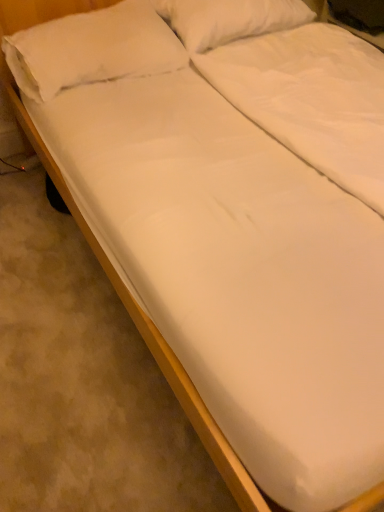
Question: Which direction should I rotate to look at white soft pillow at upper center, which ranks as the 2th pillow in left-to-right order?

Choices:
 (A) left
 (B) right

Answer: (B)

Question: Is white soft pillow at upper left, which is the second pillow from right to left, surrounding white soft pillow at upper center, which is the first pillow in right-to-left order?

Choices:
 (A) yes
 (B) no

Answer: (B)

Question: Is white soft pillow at upper left, which is the second pillow from right to left, wider than white soft pillow at upper center, which ranks as the 2th pillow in left-to-right order?

Choices:
 (A) yes
 (B) no

Answer: (A)

Question: From the image's perspective, would you say white soft pillow at upper left, arranged as the 1th pillow when viewed from the left, is shown under white soft pillow at upper center, which ranks as the 2th pillow in left-to-right order?

Choices:
 (A) no
 (B) yes

Answer: (B)

Question: From a real-world perspective, is white soft pillow at upper left, which is the second pillow from right to left, physically above white soft pillow at upper center, which is the first pillow in right-to-left order?

Choices:
 (A) no
 (B) yes

Answer: (A)

Question: Does white soft pillow at upper left, arranged as the 1th pillow when viewed from the left, have a lesser height compared to white soft pillow at upper center, which ranks as the 2th pillow in left-to-right order?

Choices:
 (A) yes
 (B) no

Answer: (A)

Question: Is white soft pillow at upper left, which is the second pillow from right to left, at the left side of white soft pillow at upper center, which is the first pillow in right-to-left order?

Choices:
 (A) no
 (B) yes

Answer: (B)

Question: Is white soft pillow at upper center, which ranks as the 2th pillow in left-to-right order, facing away from white soft pillow at upper left, which is the second pillow from right to left?

Choices:
 (A) yes
 (B) no

Answer: (B)

Question: Does white soft pillow at upper center, which is the first pillow in right-to-left order, have a smaller size compared to white soft pillow at upper left, arranged as the 1th pillow when viewed from the left?

Choices:
 (A) yes
 (B) no

Answer: (A)

Question: Is white soft pillow at upper left, which is the second pillow from right to left, inside white soft pillow at upper center, which ranks as the 2th pillow in left-to-right order?

Choices:
 (A) no
 (B) yes

Answer: (A)

Question: From the image's perspective, is white soft pillow at upper center, which is the first pillow in right-to-left order, over white soft pillow at upper left, arranged as the 1th pillow when viewed from the left?

Choices:
 (A) yes
 (B) no

Answer: (A)

Question: Does white soft pillow at upper center, which ranks as the 2th pillow in left-to-right order, have a larger size compared to white soft pillow at upper left, which is the second pillow from right to left?

Choices:
 (A) yes
 (B) no

Answer: (B)

Question: From the image's perspective, is white soft pillow at upper center, which ranks as the 2th pillow in left-to-right order, beneath white soft pillow at upper left, which is the second pillow from right to left?

Choices:
 (A) no
 (B) yes

Answer: (A)

Question: In the image, is white soft pillow at upper left, which is the second pillow from right to left, positioned in front of or behind white soft pillow at upper center, which ranks as the 2th pillow in left-to-right order?

Choices:
 (A) front
 (B) behind

Answer: (A)